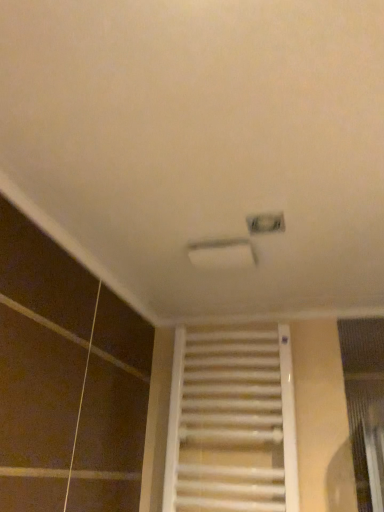
The height and width of the screenshot is (512, 384). I want to click on white wooden radiator at center, so click(x=230, y=422).

What do you see at coordinates (230, 422) in the screenshot? The height and width of the screenshot is (512, 384). I see `white wooden radiator at center` at bounding box center [230, 422].

Measure the distance between white wooden radiator at center and camera.

white wooden radiator at center and camera are 1.16 meters apart.

What are the coordinates of `white wooden radiator at center` in the screenshot? It's located at (230, 422).